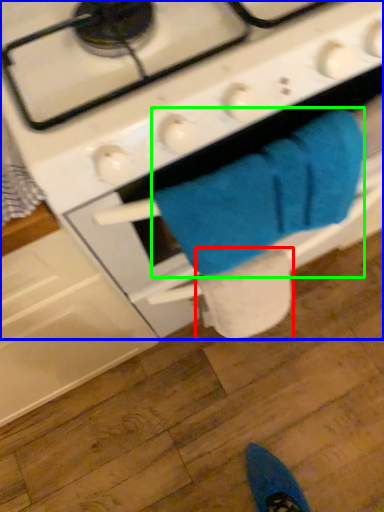
Question: Which is nearer to the toilet paper (highlighted by a red box)? gas stove (highlighted by a blue box) or bath towel (highlighted by a green box).

Choices:
 (A) gas stove
 (B) bath towel

Answer: (B)